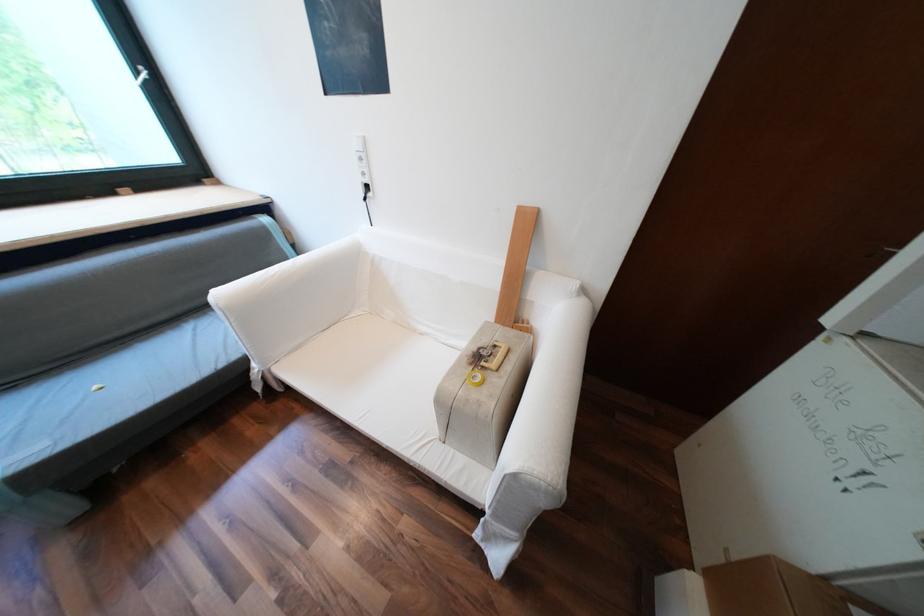
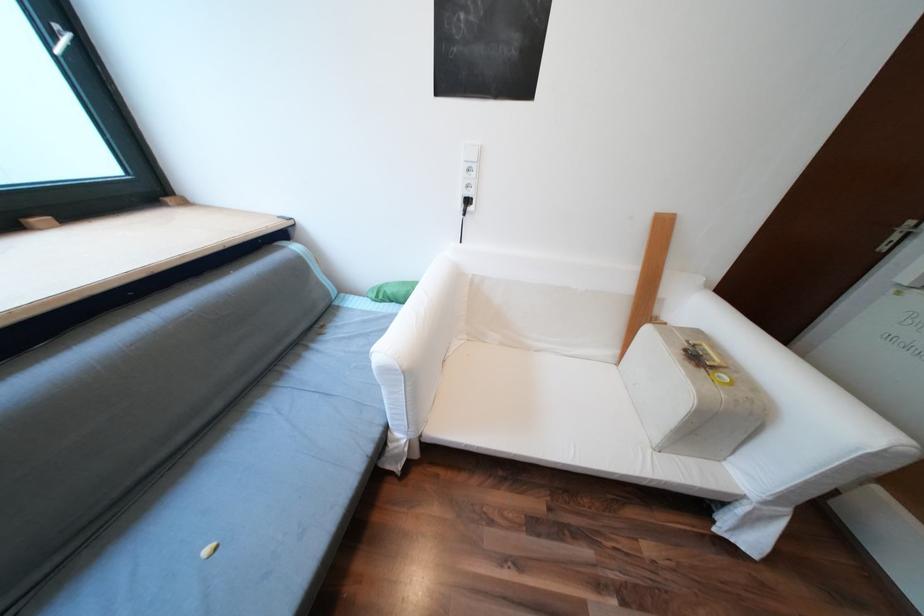
Question: Which direction would the cameraman need to move to produce the second image? Reply with the corresponding letter.

Choices:
 (A) Left
 (B) Right
 (C) Forward
 (D) Backward

Answer: (A)